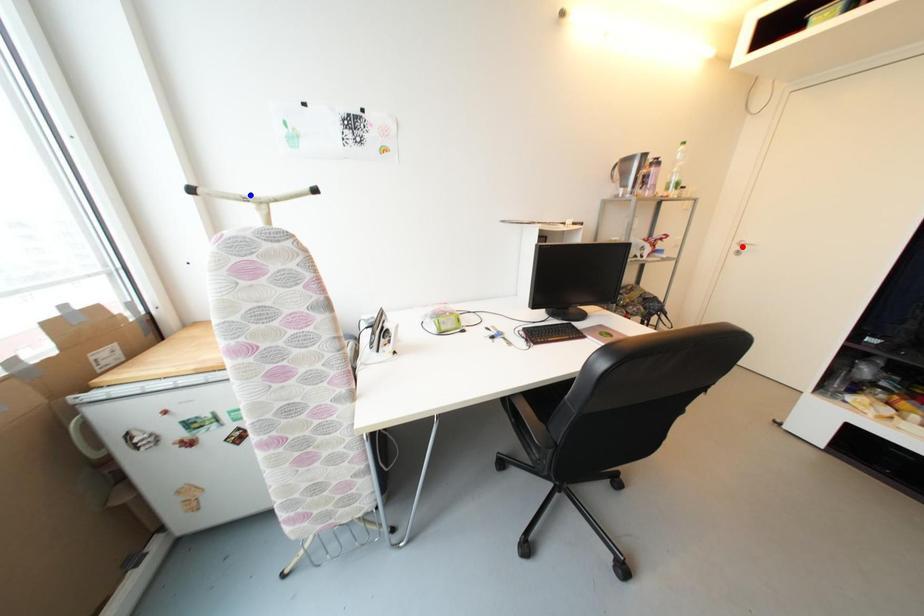
Question: In the image, two points are highlighted. Which point is nearer to the camera? Reply with the corresponding letter.

Choices:
 (A) blue point
 (B) red point

Answer: (A)